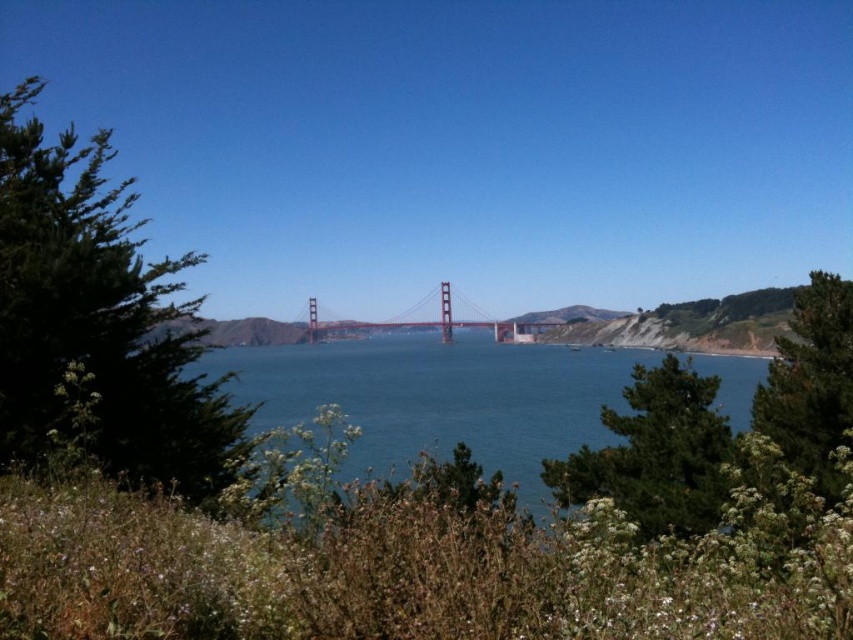
You are a photographer planning to capture the Golden Gate Bridge in a wide shot. You want to ensure that both the blue water at center and the green leafy tree at center are visible in the frame. Given their sizes, which object will occupy more space in your photograph?

The blue water at center will occupy more space in the photograph because its width is larger than that of the green leafy tree at center.

You are a photographer planning to capture the Golden Gate Bridge with both the green leafy tree at left and the blue water at center in the same frame. Which object should you focus on first to ensure both are in the shot?

The green leafy tree at left is taller than the blue water at center, so you should focus on the green leafy tree at left first to ensure both are in the shot.

You are standing at the center of the Golden Gate Bridge and looking towards the right side. Can you see the green leafy tree at right from this position?

Yes, the green leafy tree at right is located at the right side of the Golden Gate Bridge, so you can see it from the center while looking towards the right.